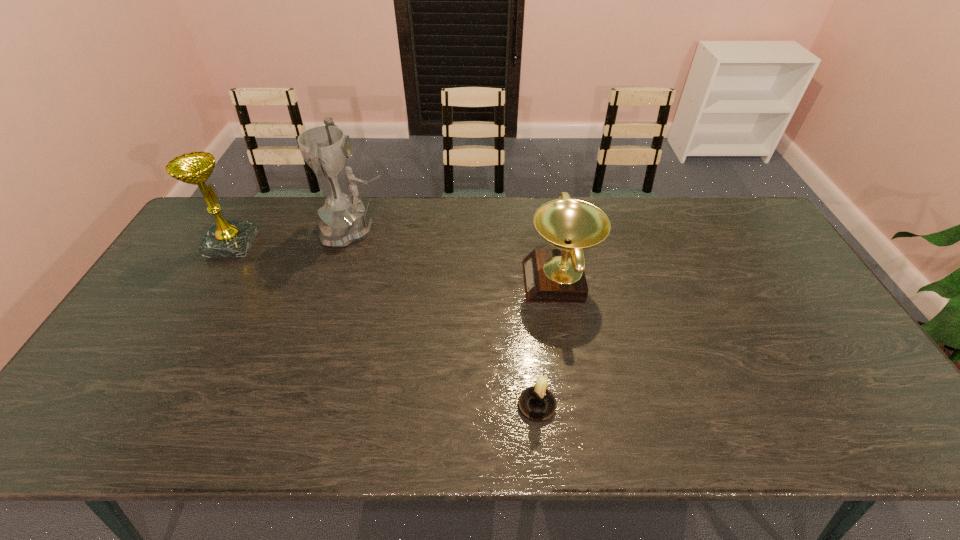
Where is `vacant space that is in between the second object from left to right and the rightmost award`? The image size is (960, 540). vacant space that is in between the second object from left to right and the rightmost award is located at coordinates (458, 255).

Find the location of `free spot between the second award from left to right and the shortest object`. free spot between the second award from left to right and the shortest object is located at coordinates (447, 318).

Locate an element on the screen. Image resolution: width=960 pixels, height=540 pixels. free space between the shortest award and the tallest object is located at coordinates (458, 255).

Find the location of a particular element. The width and height of the screenshot is (960, 540). object that is the third closest to the second tallest award is located at coordinates (537, 403).

Select which object is the third closest to the second award from right to left. Please provide its 2D coordinates. Your answer should be formatted as a tuple, i.e. [(x, y)], where the tuple contains the x and y coordinates of a point satisfying the conditions above.

[(537, 403)]

Locate an element on the screen. The image size is (960, 540). award object that ranks as the second closest to the leftmost object is located at coordinates (550, 275).

At what (x,y) coordinates should I click in order to perform the action: click on award that is the closest to the candle holder. Please return your answer as a coordinate pair (x, y). This screenshot has height=540, width=960. Looking at the image, I should click on (550, 275).

At what (x,y) coordinates should I click in order to perform the action: click on vacant space that satisfies the following two spatial constraints: 1. on the side with emblem of the second award from left to right; 2. on the back side of the candle holder. Please return your answer as a coordinate pair (x, y). The image size is (960, 540). Looking at the image, I should click on (304, 406).

Where is `free location that satisfies the following two spatial constraints: 1. on the side with emblem of the shortest object; 2. on the left side of the second award from left to right`? The image size is (960, 540). free location that satisfies the following two spatial constraints: 1. on the side with emblem of the shortest object; 2. on the left side of the second award from left to right is located at coordinates (304, 406).

This screenshot has height=540, width=960. I want to click on free spot that satisfies the following two spatial constraints: 1. on the front-facing side of the rightmost award; 2. on the front side of the nearest object, so click(581, 406).